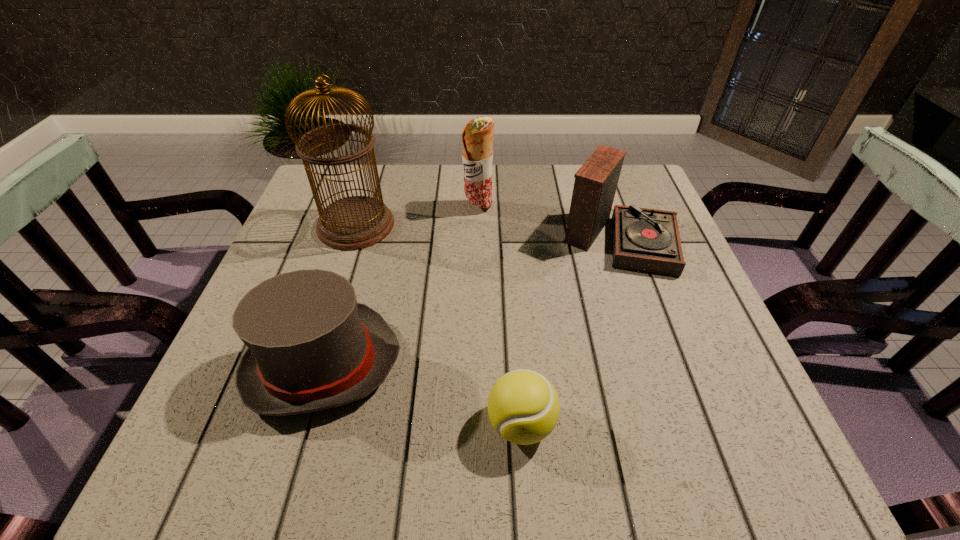
Identify the location of the tallest object. (356, 222).

At what (x,y) coordinates should I click in order to perform the action: click on the second tallest object. Please return your answer as a coordinate pair (x, y). Looking at the image, I should click on (477, 136).

Identify the location of the rightmost object. This screenshot has width=960, height=540. (647, 240).

Image resolution: width=960 pixels, height=540 pixels. Identify the location of dress hat. (311, 346).

Identify the location of the shortest object. The width and height of the screenshot is (960, 540). (523, 406).

I want to click on vacant position located 0.130m on the front-facing side of the tallest object, so click(447, 226).

Where is `vacant area situated on the right of the second tallest object`? The height and width of the screenshot is (540, 960). vacant area situated on the right of the second tallest object is located at coordinates (563, 207).

Locate an element on the screen. This screenshot has width=960, height=540. vacant region located on the left of the phonograph record is located at coordinates (540, 237).

Locate an element on the screen. free region located 0.070m on the right of the dress hat is located at coordinates (438, 364).

Image resolution: width=960 pixels, height=540 pixels. In order to click on vacant region located 0.060m on the left of the tennis ball in this screenshot , I will do (x=450, y=424).